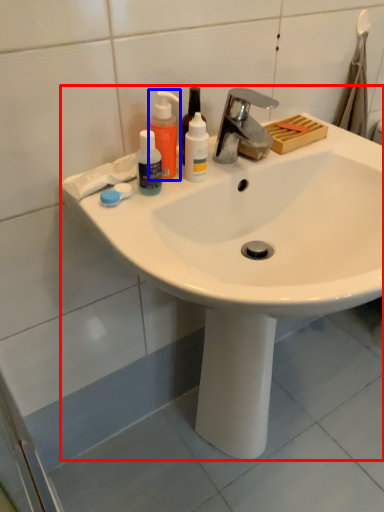
Question: Which object appears farthest to the camera in this image, sink (highlighted by a red box) or cleaning product (highlighted by a blue box)?

Choices:
 (A) sink
 (B) cleaning product

Answer: (B)